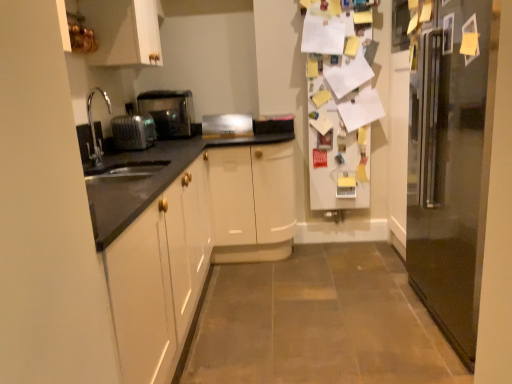
Question: Does satin silver toaster at center, the second appliance viewed from the front, have a lesser width compared to satin silver toaster at left, the 1th appliance when ordered from front to back?

Choices:
 (A) no
 (B) yes

Answer: (B)

Question: Is satin silver toaster at center, placed as the first appliance when sorted from right to left, not close to satin silver toaster at left, which is the 2th appliance in right-to-left order?

Choices:
 (A) no
 (B) yes

Answer: (A)

Question: From a real-world perspective, is satin silver toaster at center, the second appliance viewed from the front, located higher than satin silver toaster at left, which appears as the second appliance when viewed from the back?

Choices:
 (A) yes
 (B) no

Answer: (B)

Question: Can we say satin silver toaster at center, the 1th appliance from the back, lies outside satin silver toaster at left, which is the 2th appliance in right-to-left order?

Choices:
 (A) no
 (B) yes

Answer: (B)

Question: Does satin silver toaster at center, the second appliance viewed from the front, turn towards satin silver toaster at left, the 1th appliance when ordered from front to back?

Choices:
 (A) no
 (B) yes

Answer: (A)

Question: Is satin silver toaster at center, the 1th appliance from the back, at the right side of satin silver toaster at left, which is the 1th appliance in left-to-right order?

Choices:
 (A) yes
 (B) no

Answer: (A)

Question: Considering the relative sizes of satin silver toaster at center, placed as the first appliance when sorted from right to left, and satin silver toaster at left in the image provided, is satin silver toaster at center, placed as the first appliance when sorted from right to left, thinner than satin silver toaster at left?

Choices:
 (A) no
 (B) yes

Answer: (B)

Question: Can you confirm if satin silver toaster at center, placed as the first appliance when sorted from right to left, is bigger than satin silver toaster at left?

Choices:
 (A) no
 (B) yes

Answer: (A)

Question: Is satin silver toaster at center, the 1th appliance from the back, oriented towards satin silver toaster at left?

Choices:
 (A) no
 (B) yes

Answer: (A)

Question: Considering the relative sizes of satin silver toaster at center, placed as the first appliance when sorted from right to left, and satin silver toaster at left in the image provided, is satin silver toaster at center, placed as the first appliance when sorted from right to left, taller than satin silver toaster at left?

Choices:
 (A) yes
 (B) no

Answer: (B)

Question: Is satin silver toaster at center, the second appliance positioned from the left, at the left side of satin silver toaster at left?

Choices:
 (A) yes
 (B) no

Answer: (B)

Question: Is satin silver toaster at center, placed as the first appliance when sorted from right to left, facing away from satin silver toaster at left?

Choices:
 (A) yes
 (B) no

Answer: (B)

Question: Can you confirm if satin silver toaster at center, placed as the first appliance when sorted from right to left, is wider than metallic stainless steel refrigerator at right?

Choices:
 (A) yes
 (B) no

Answer: (B)